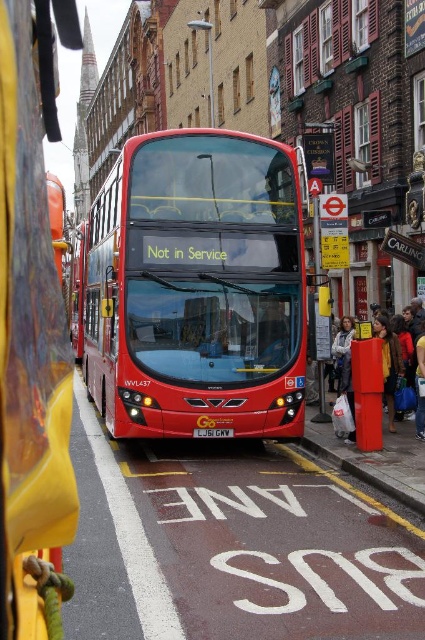
You are a delivery person trying to find a red plastic box at right to leave a package. The GPS shows a point at coordinate (393,369). Is this point the correct location for the red plastic box at right?

Yes, the point at coordinate (393,369) corresponds to the red plastic box at right, so you can leave the package there.

You are a tour guide pointing out landmarks to tourists. You want to indicate the shiny red bus at center to your audience. Where exactly should you point on the screen to accurately locate it?

You should point to the coordinates at point (197, 288) to accurately locate the shiny red bus at center.

You are a photographer trying to capture a clear shot of the shiny red bus at center and the yellow metallic license plate at center. Since you want both in focus, you need to know their relative sizes. Which object is taller?

The shiny red bus at center is taller than the yellow metallic license plate at center.